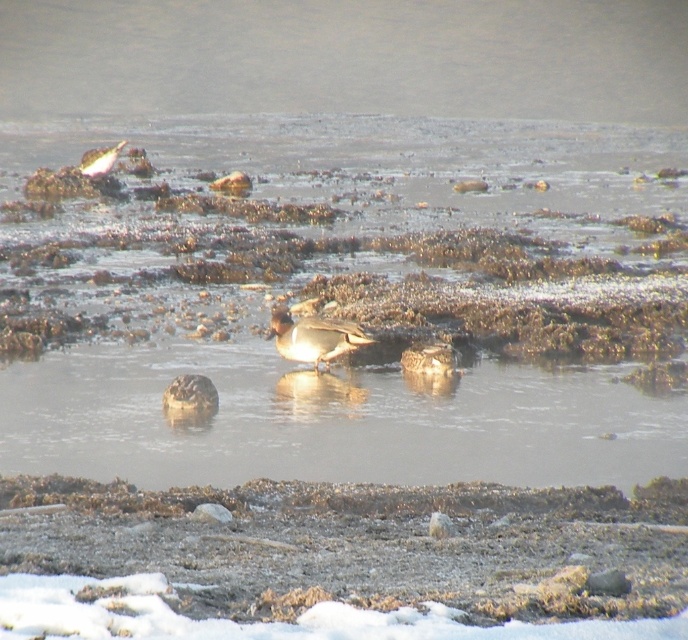
Question: Among these objects, which one is farthest from the camera?

Choices:
 (A) brown dirt at lower center
 (B) clear water at center
 (C) brown speckled duck at center
 (D) brown feathered duck at upper left

Answer: (D)

Question: Which point is farther from the camera taking this photo?

Choices:
 (A) (92, 173)
 (B) (294, 356)
 (C) (455, 369)

Answer: (A)

Question: Is brown feathered duck at center wider than brown speckled duck at center?

Choices:
 (A) no
 (B) yes

Answer: (B)

Question: Is brown feathered duck at center to the right of brown speckled duck at center from the viewer's perspective?

Choices:
 (A) no
 (B) yes

Answer: (A)

Question: Which point is farther from the camera taking this photo?

Choices:
 (A) (407, 362)
 (B) (365, 486)
 (C) (246, 458)
 (D) (87, 173)

Answer: (D)

Question: Is clear water at center closer to camera compared to brown speckled duck at center?

Choices:
 (A) no
 (B) yes

Answer: (B)